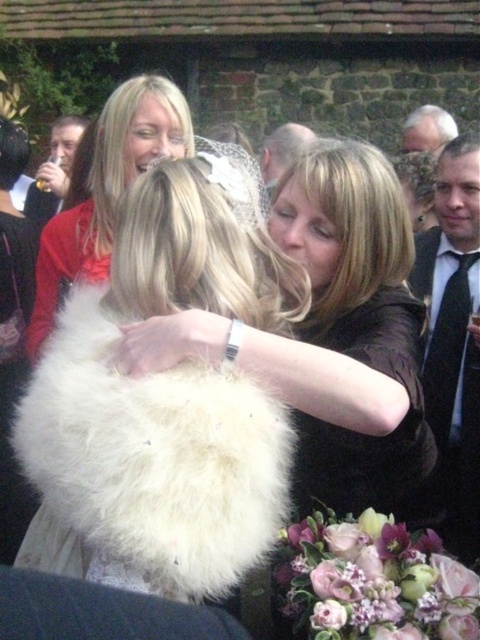
You are a photographer at a wedding reception. You need to capture a closeup shot of the white fluffy coat at center and the smooth bald head at center. The camera you are using has a minimum focusing distance of 2 meters. Can you take the closeup without moving the subjects?

The white fluffy coat at center is 2.57 meters from the smooth bald head at center. Since the minimum focusing distance of the camera is 2 meters, the distance between them is sufficient for capturing a closeup without moving the subjects.

You are a photographer at the wedding and want to capture a closeup shot of the two women hugging. However, you notice an object in the foreground might block the view. Which object between the matte white fur at center and the white hair at upper right is taller and would block the shot more?

The matte white fur at center is much taller than the white hair at upper right, so it would block the shot more.